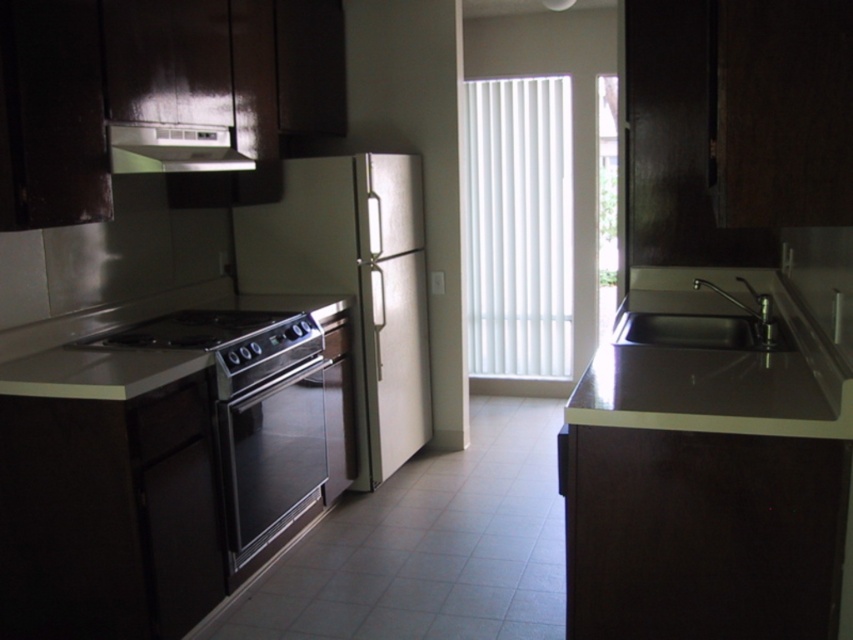
Question: Does satin black oven at center have a larger size compared to satin silver exhaust hood at upper center?

Choices:
 (A) no
 (B) yes

Answer: (B)

Question: Which object appears closest to the camera in this image?

Choices:
 (A) transparent mesh screen door at lower left
 (B) glossy wood cabinet at upper right
 (C) brushed metal cabinet at left

Answer: (B)

Question: Where is brushed metal cabinet at left located in relation to transparent mesh screen door at lower left in the image?

Choices:
 (A) below
 (B) above

Answer: (B)

Question: Among these objects, which one is farthest from the camera?

Choices:
 (A) brushed metal cabinet at left
 (B) stainless steel oven at lower left
 (C) glossy wood cabinet at upper right
 (D) black stainless steel sink at right

Answer: (B)

Question: Observing the image, what is the correct spatial positioning of satin silver refrigerator at center in reference to satin silver exhaust hood at upper center?

Choices:
 (A) right
 (B) left

Answer: (A)

Question: Among these points, which one is nearest to the camera?

Choices:
 (A) (558, 332)
 (B) (283, 470)
 (C) (213, 156)
 (D) (827, 61)

Answer: (D)